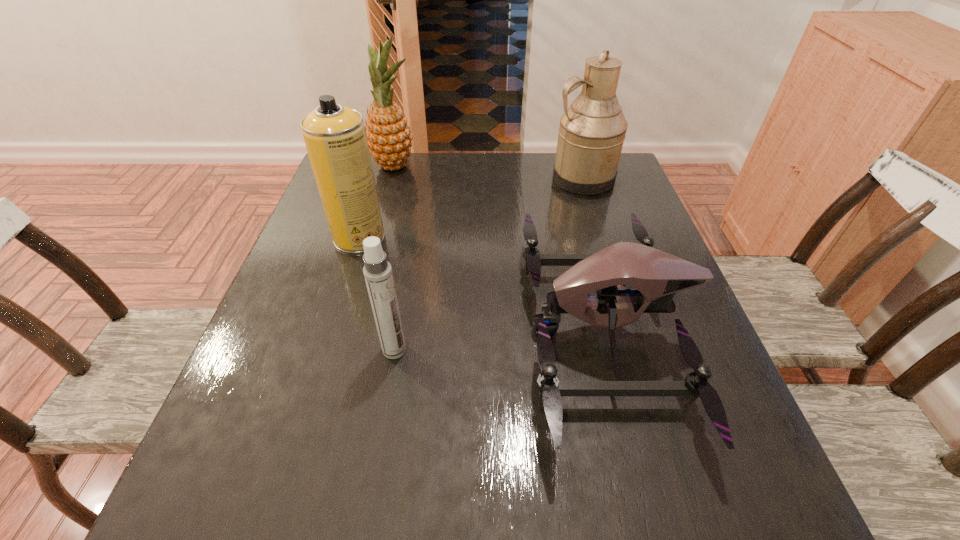
Locate an element on the screen. This screenshot has height=540, width=960. drone at the right edge is located at coordinates (656, 276).

Where is `object situated at the far left corner`? object situated at the far left corner is located at coordinates (388, 135).

Find the location of a particular element. The width and height of the screenshot is (960, 540). object located in the far right corner section of the desktop is located at coordinates (592, 130).

Find the location of `object situated at the near right corner`. object situated at the near right corner is located at coordinates (656, 276).

This screenshot has height=540, width=960. In the image, there is a desktop. What are the coordinates of `vacant space at the far edge` in the screenshot? It's located at (514, 153).

Image resolution: width=960 pixels, height=540 pixels. Identify the location of free space at the near edge. (515, 516).

Where is `free space at the left edge of the desktop`? The image size is (960, 540). free space at the left edge of the desktop is located at coordinates (300, 338).

This screenshot has height=540, width=960. Identify the location of free space that is in between the pineapple and the nearer aerosol can. (395, 258).

I want to click on vacant point located between the shortest object and the farther aerosol can, so click(x=482, y=285).

Locate an element on the screen. free space between the left aerosol can and the drone is located at coordinates (482, 285).